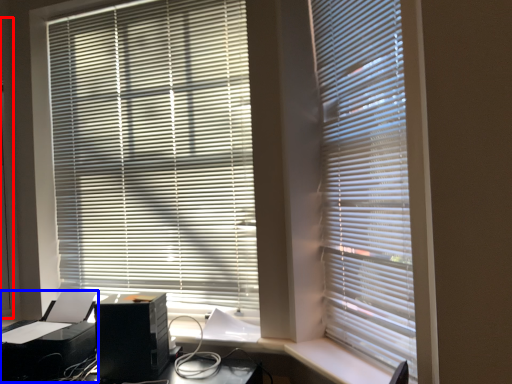
Question: Among these objects, which one is nearest to the camera, screen door (highlighted by a red box) or printer (highlighted by a blue box)?

Choices:
 (A) screen door
 (B) printer

Answer: (B)